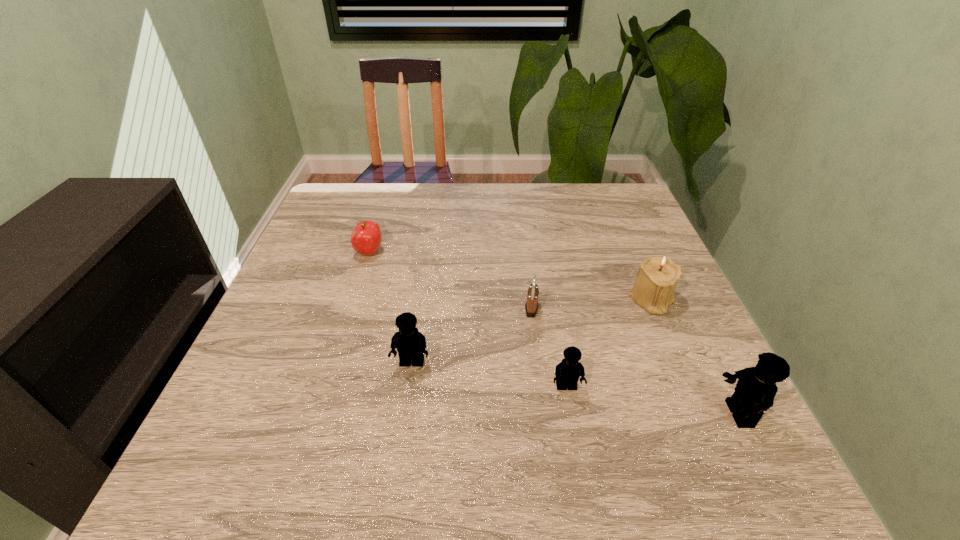
Please point out where to position a new Lego on the left to maintain spacing. Please provide its 2D coordinates. Your answer should be formatted as a tuple, i.e. [(x, y)], where the tuple contains the x and y coordinates of a point satisfying the conditions above.

[(272, 341)]